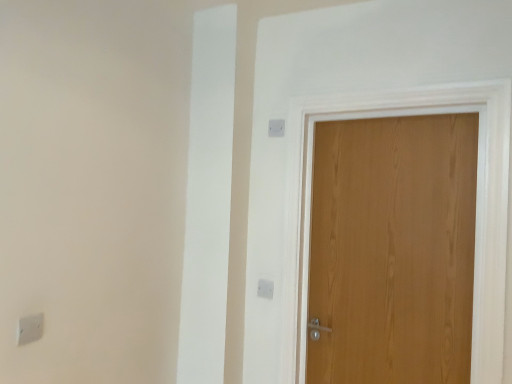
Question: Is white plastic light switch at upper center, the third light switch in the left-to-right sequence, bigger or smaller than white plastic light switch at lower left, the first light switch when ordered from front to back?

Choices:
 (A) big
 (B) small

Answer: (B)

Question: Is point (274, 132) positioned closer to the camera than point (29, 322)?

Choices:
 (A) closer
 (B) farther

Answer: (B)

Question: Estimate the real-world distances between objects in this image. Which object is farther from the white plastic light switch at lower left, which is the 2th light switch from top to bottom?

Choices:
 (A) wooden door at right
 (B) white plastic light switch at upper center, the second light switch in the right-to-left sequence
 (C) white plastic light switch at upper center, positioned as the second light switch in back-to-front order

Answer: (A)

Question: Which object is the farthest from the white plastic light switch at lower left, marked as the 2th light switch in a bottom-to-top arrangement?

Choices:
 (A) white plastic light switch at upper center, the 1th light switch from the back
 (B) white plastic light switch at upper center, which appears as the third light switch when ordered from the bottom
 (C) wooden door at right

Answer: (C)